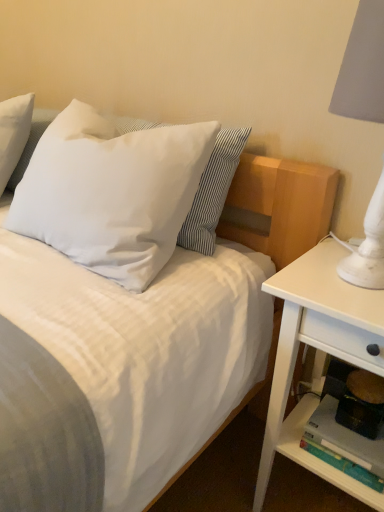
This screenshot has height=512, width=384. Identify the location of vacant space situated above matte plastic shelf at lower right (from a real-world perspective). (346, 428).